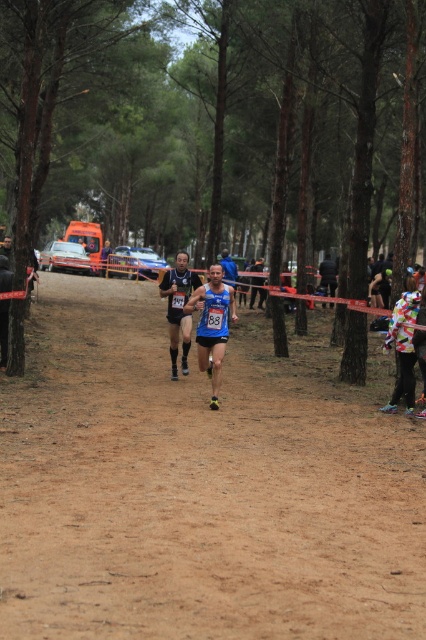
Question: Which object appears farthest from the camera in this image?

Choices:
 (A) matte blue running suit at center
 (B) blue fabric running suit at center
 (C) multicolored fabric at right

Answer: (A)

Question: Is matte blue running suit at center thinner than blue fabric shirt at center?

Choices:
 (A) no
 (B) yes

Answer: (A)

Question: Which object appears closest to the camera in this image?

Choices:
 (A) dark blue fabric runner at center
 (B) multicolored fabric at right
 (C) blue fabric shirt at center

Answer: (B)

Question: Is dark blue fabric runner at center wider than blue fabric shirt at center?

Choices:
 (A) no
 (B) yes

Answer: (B)

Question: Is dark blue fabric runner at center wider than blue fabric shirt at center?

Choices:
 (A) yes
 (B) no

Answer: (A)

Question: Which object appears closest to the camera in this image?

Choices:
 (A) blue fabric shirt at center
 (B) dark blue fabric runner at center
 (C) blue fabric running suit at center
 (D) matte blue running suit at center

Answer: (C)